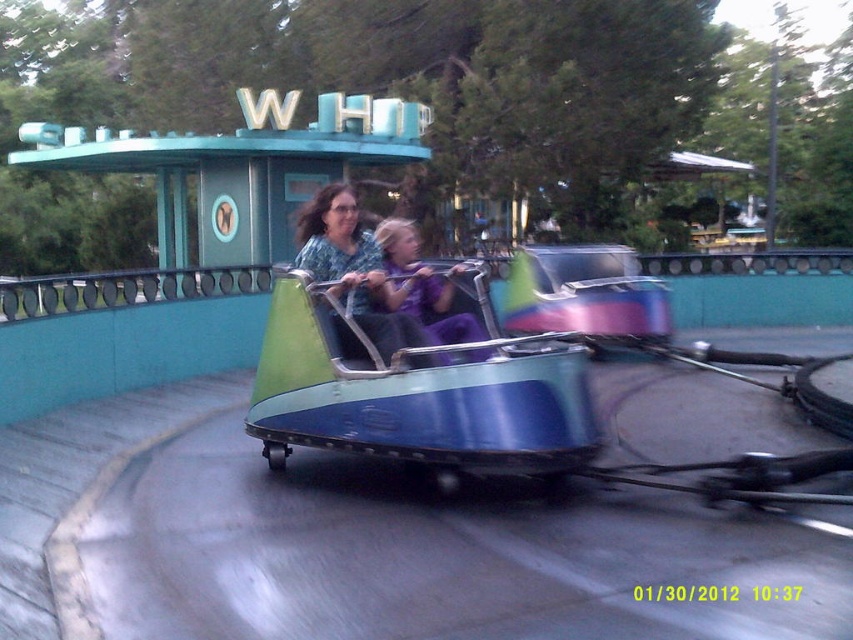
Who is shorter, matte green car at center or purple fabric at center?

Standing shorter between the two is purple fabric at center.

Is point (352, 237) more distant than point (426, 284)?

No.

I want to click on matte green car at center, so click(x=354, y=268).